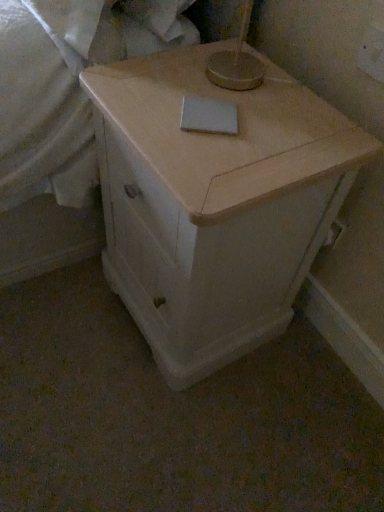
Identify the location of free point in front of white matte notepad at center. Image resolution: width=384 pixels, height=512 pixels. (215, 157).